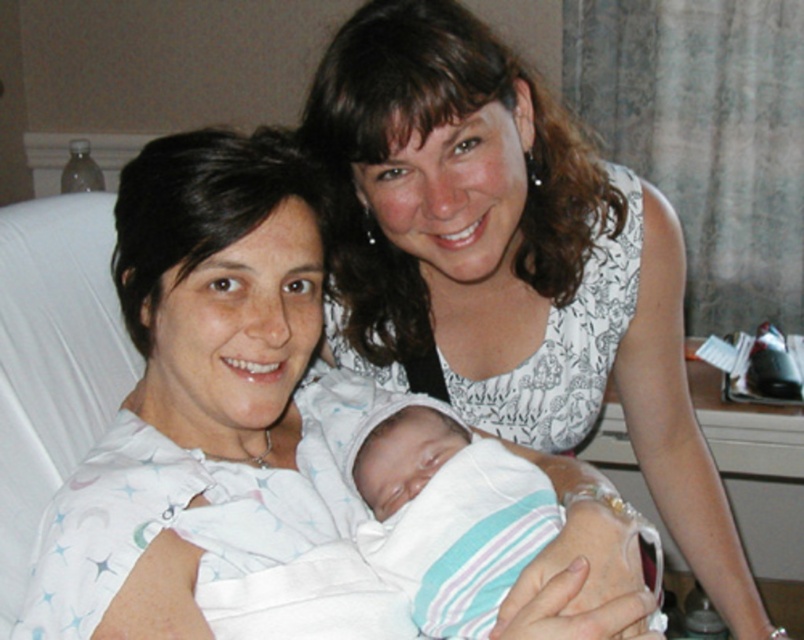
You are a nurse in a hospital. You need to place a thermometer on the white fabric baby at center and the white striped fabric at center. Which one can you place the thermometer on without it falling off?

The thermometer can be placed on the white fabric baby at center because it is 6.91 inches away from the white striped fabric at center, so the baby is a stable surface compared to the fabric.

You are a nurse in the hospital. You need to place a monitor on the bed near the white fabric baby at center. Where should you place it so that it is closest to the baby?

The nurse should place the monitor near the point with coordinates 0.598 in the x axis and 0.255 in the y axis, which is the location of the white fabric baby at center.

You are a nurse in a hospital and need to determine if the white fabric baby at center can fit into a bassinet that is the same size as the white striped fabric at center. Based on the information provided, can the baby fit into the bassinet?

The white fabric baby at center is larger in width than the white striped fabric at center, so the baby cannot fit into the bassinet of the same size as the white striped fabric at center.